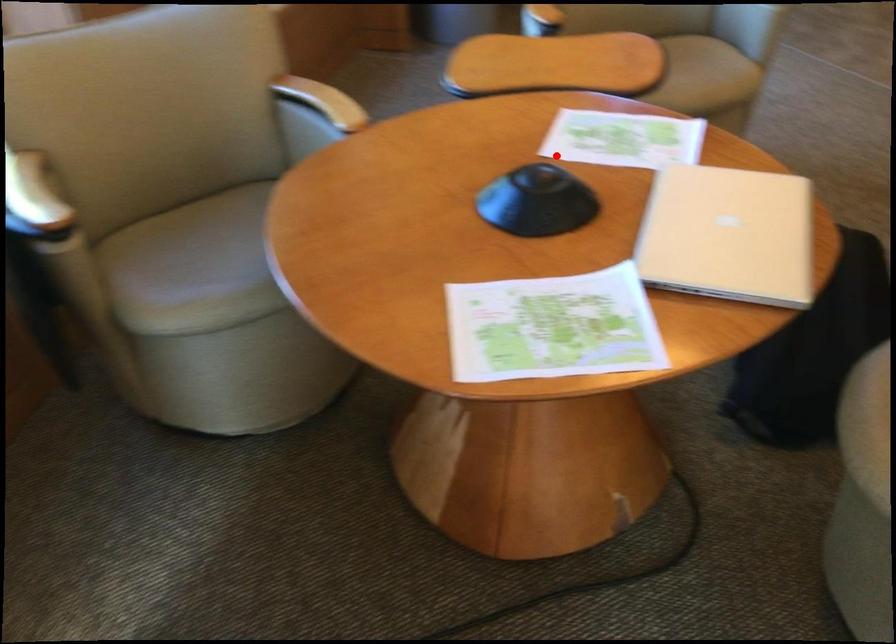
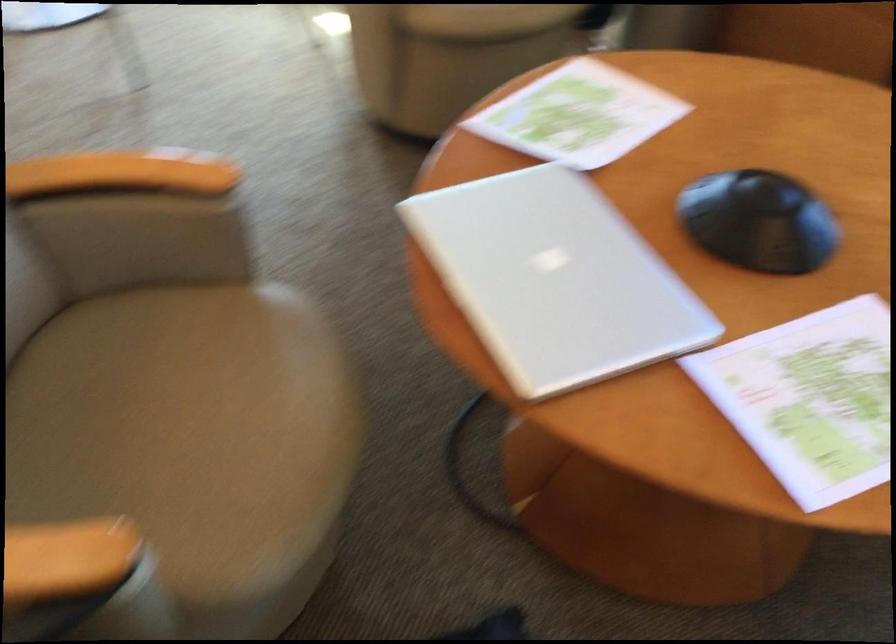
In the second image, find the point that corresponds to the highlighted location in the first image.

(810, 399)